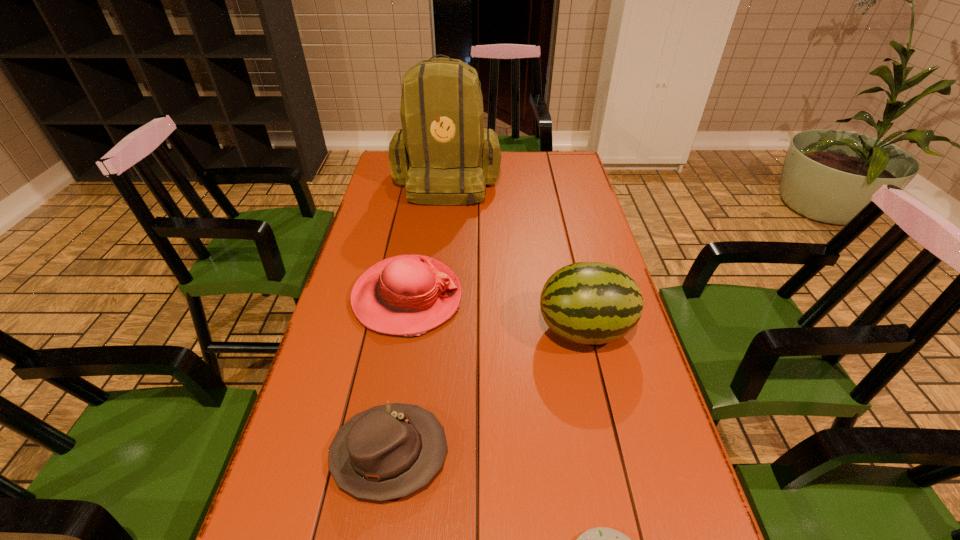
Identify the location of the farthest object. (443, 154).

You are a GUI agent. You are given a task and a screenshot of the screen. Output one action in this format:
    pyautogui.click(x=<x>, y=<y>)
    Task: Click on the tallest object
    The image size is (960, 540).
    Given the screenshot: What is the action you would take?
    pyautogui.click(x=443, y=154)

Find the location of `watermelon`. watermelon is located at coordinates (591, 303).

This screenshot has width=960, height=540. Identify the location of the third tallest object. (406, 295).

Locate an element on the screen. This screenshot has width=960, height=540. the taller hat is located at coordinates (406, 295).

Identify the location of the shorter hat. (386, 452).

At what (x,y) coordinates should I click in order to perform the action: click on the nearer hat. Please return your answer as a coordinate pair (x, y). The image size is (960, 540). Looking at the image, I should click on (386, 452).

The height and width of the screenshot is (540, 960). I want to click on vacant area located 0.390m on the front-facing side of the tallest object, so click(436, 283).

Where is `vacant space located at the stem end of the fourth shortest object`? vacant space located at the stem end of the fourth shortest object is located at coordinates (456, 330).

Identify the location of free space located at the stem end of the fourth shortest object. (514, 330).